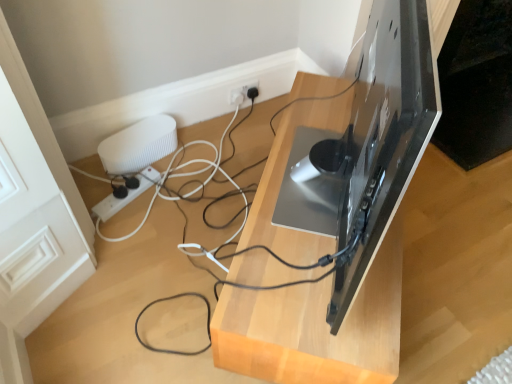
Question: Should I look upward or downward to see matte black tv stand at center?

Choices:
 (A) up
 (B) down

Answer: (B)

Question: Does matte black tv stand at center contain white plastic power strip at lower left?

Choices:
 (A) no
 (B) yes

Answer: (A)

Question: From the image's perspective, does matte black tv stand at center appear higher than white plastic power strip at lower left?

Choices:
 (A) yes
 (B) no

Answer: (B)

Question: From the image's perspective, would you say matte black tv stand at center is shown under white plastic power strip at lower left?

Choices:
 (A) yes
 (B) no

Answer: (A)

Question: Is matte black tv stand at center facing away from white plastic power strip at lower left?

Choices:
 (A) yes
 (B) no

Answer: (A)

Question: Is matte black tv stand at center further to the viewer compared to white plastic power strip at lower left?

Choices:
 (A) yes
 (B) no

Answer: (B)

Question: Is matte black tv stand at center at the right side of white plastic power strip at lower left?

Choices:
 (A) no
 (B) yes

Answer: (B)

Question: From the image's perspective, is white plastic power strip at lower left on white ribbed speaker at left?

Choices:
 (A) yes
 (B) no

Answer: (B)

Question: Is white plastic power strip at lower left bigger than white ribbed speaker at left?

Choices:
 (A) no
 (B) yes

Answer: (A)

Question: Is white plastic power strip at lower left taller than white ribbed speaker at left?

Choices:
 (A) yes
 (B) no

Answer: (B)

Question: Considering the relative positions of white plastic power strip at lower left and white ribbed speaker at left in the image provided, is white plastic power strip at lower left to the left of white ribbed speaker at left from the viewer's perspective?

Choices:
 (A) no
 (B) yes

Answer: (B)

Question: From a real-world perspective, does white plastic power strip at lower left stand above white ribbed speaker at left?

Choices:
 (A) yes
 (B) no

Answer: (B)

Question: From the image's perspective, is white plastic power strip at lower left under white ribbed speaker at left?

Choices:
 (A) yes
 (B) no

Answer: (A)

Question: Is white ribbed speaker at left not inside matte black tv stand at center?

Choices:
 (A) yes
 (B) no

Answer: (A)